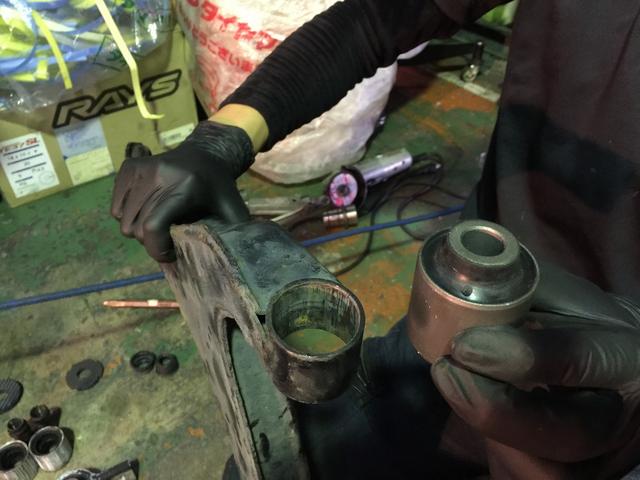
The height and width of the screenshot is (480, 640). I want to click on cup, so click(x=303, y=354).